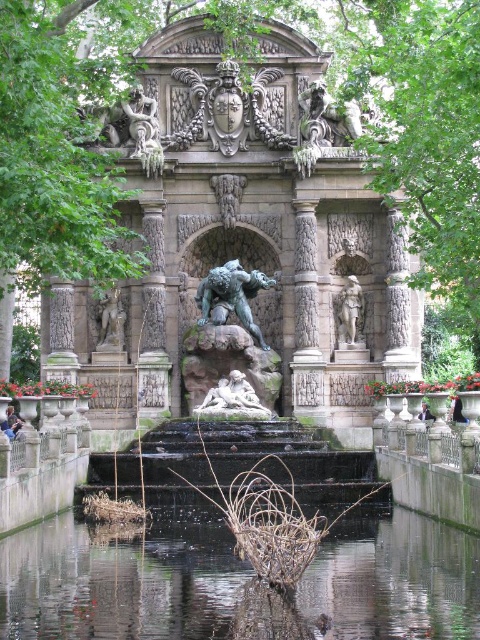
Question: Does clear water at center lie in front of polished bronze statue at upper center?

Choices:
 (A) no
 (B) yes

Answer: (B)

Question: Among these objects, which one is farthest from the camera?

Choices:
 (A) carved stone fountain at center
 (B) clear water at center
 (C) bronze statue at left

Answer: (C)

Question: Which object is closer to the camera taking this photo?

Choices:
 (A) bronze statue of man at center
 (B) clear water at center
 (C) carved stone fountain at center

Answer: (B)

Question: Is clear water at center above green stone statue at center?

Choices:
 (A) no
 (B) yes

Answer: (A)

Question: Is carved stone fountain at center to the right of bronze statue at left from the viewer's perspective?

Choices:
 (A) no
 (B) yes

Answer: (B)

Question: Estimate the real-world distances between objects in this image. Which object is farther from the clear water at center?

Choices:
 (A) white marble reclining figure at center
 (B) carved stone fountain at center

Answer: (B)